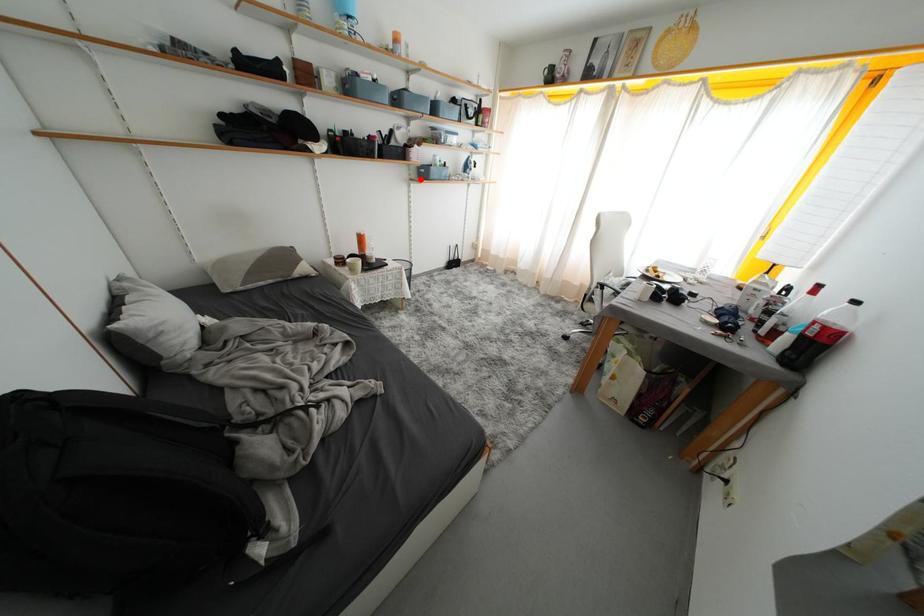
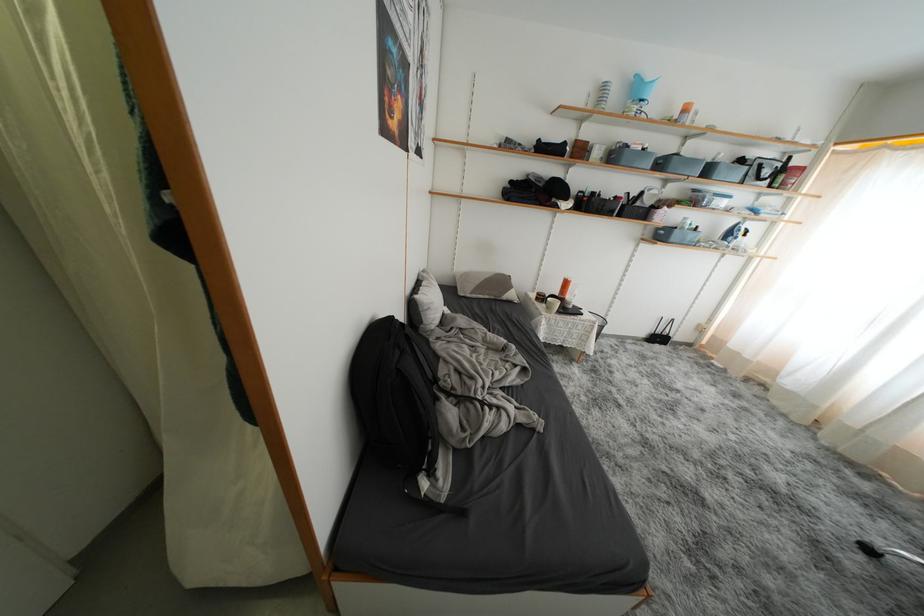
Question: A red point is marked in image1. In image2, is the corresponding 3D point closer to the camera or farther? Reply with the corresponding letter.

Choices:
 (A) The corresponding 3D point is closer.
 (B) The corresponding 3D point is farther.

Answer: (B)